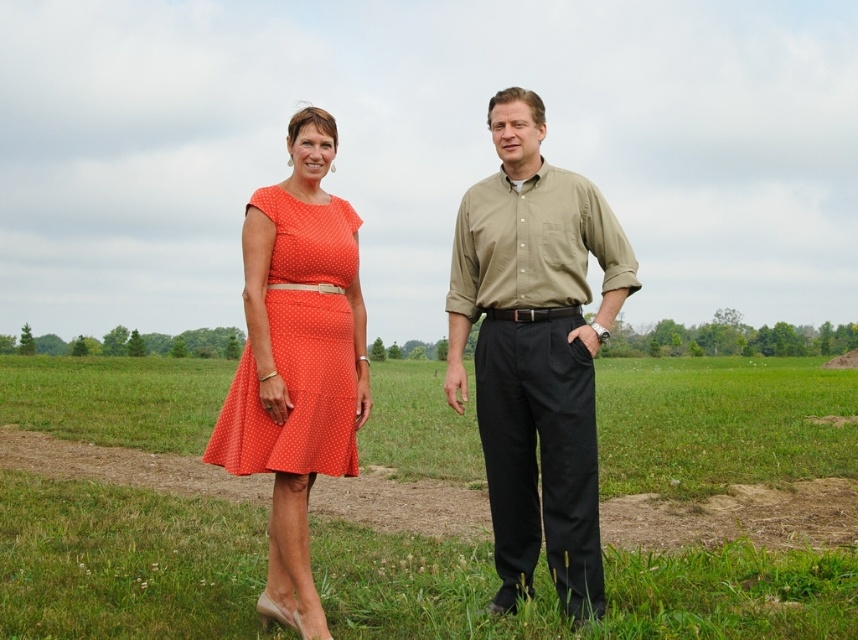
Question: Can you confirm if green grass at center is positioned to the right of orange polka dot dress at left?

Choices:
 (A) yes
 (B) no

Answer: (A)

Question: Can you confirm if orange dotted dress at left is thinner than orange polka dot dress at left?

Choices:
 (A) no
 (B) yes

Answer: (B)

Question: Considering the real-world distances, which object is closest to the matte orange dress at center?

Choices:
 (A) matte khaki shirt at center
 (B) green grass at center

Answer: (A)

Question: Is matte orange dress at center thinner than matte khaki shirt at center?

Choices:
 (A) no
 (B) yes

Answer: (A)

Question: Considering the real-world distances, which object is farthest from the orange polka dot dress at left?

Choices:
 (A) matte orange dress at center
 (B) orange dotted dress at left

Answer: (A)

Question: Which point is closer to the camera taking this photo?

Choices:
 (A) (x=588, y=454)
 (B) (x=620, y=390)
 (C) (x=266, y=236)
 (D) (x=275, y=317)

Answer: (A)